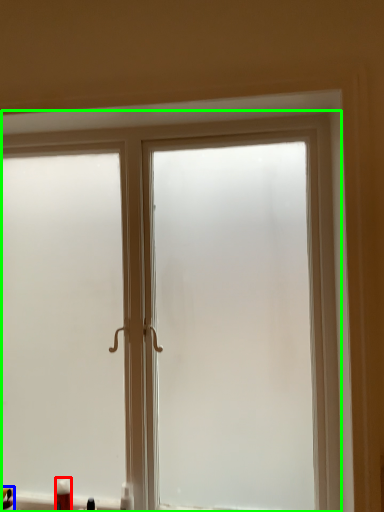
Question: Which object is the farthest from toiletry (highlighted by a red box)? Choose among these: toiletry (highlighted by a blue box) or window (highlighted by a green box).

Choices:
 (A) toiletry
 (B) window

Answer: (B)